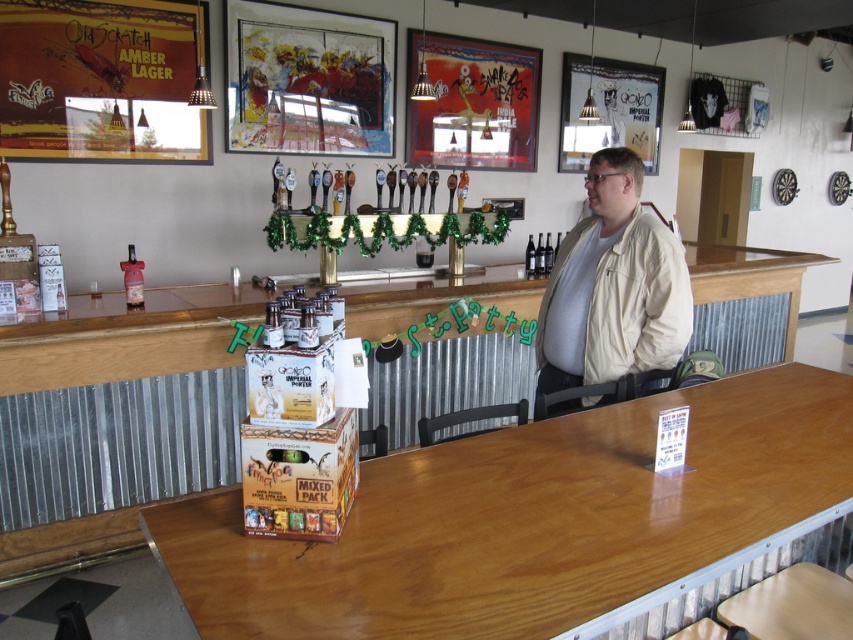
Question: Is the position of beige leather jacket at center less distant than that of brown cardboard mixed pack at center?

Choices:
 (A) yes
 (B) no

Answer: (B)

Question: Which of these objects is positioned closest to the wooden table at center?

Choices:
 (A) matte wooden signboard at upper left
 (B) beige leather jacket at center

Answer: (B)

Question: Is beige leather jacket at center to the left of brown cardboard mixed pack at center from the viewer's perspective?

Choices:
 (A) no
 (B) yes

Answer: (A)

Question: Which of these objects is positioned closest to the brown cardboard mixed pack at center?

Choices:
 (A) matte wooden signboard at upper left
 (B) wooden table at center
 (C) beige leather jacket at center

Answer: (B)

Question: Which of the following is the closest to the observer?

Choices:
 (A) matte wooden signboard at upper left
 (B) wooden table at center
 (C) brown cardboard mixed pack at center
 (D) beige leather jacket at center

Answer: (B)

Question: In this image, where is wooden table at center located relative to beige leather jacket at center?

Choices:
 (A) below
 (B) above

Answer: (A)